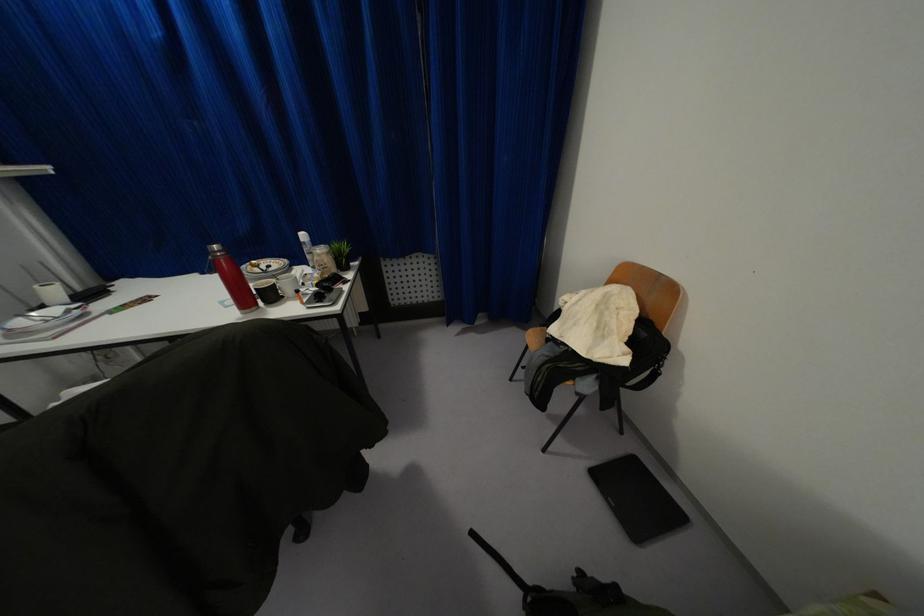
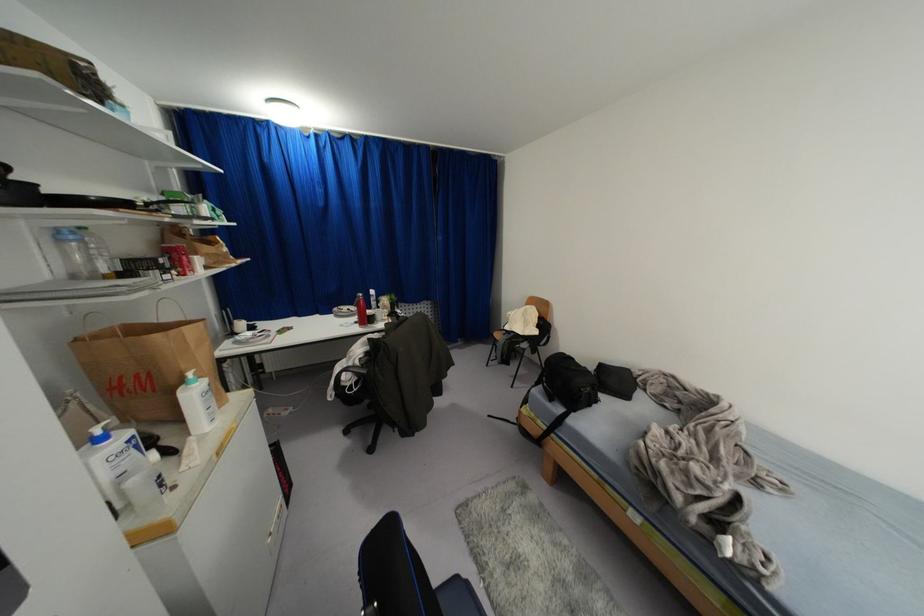
Find the pixel in the second image that matches point (41, 307) in the first image.

(234, 333)